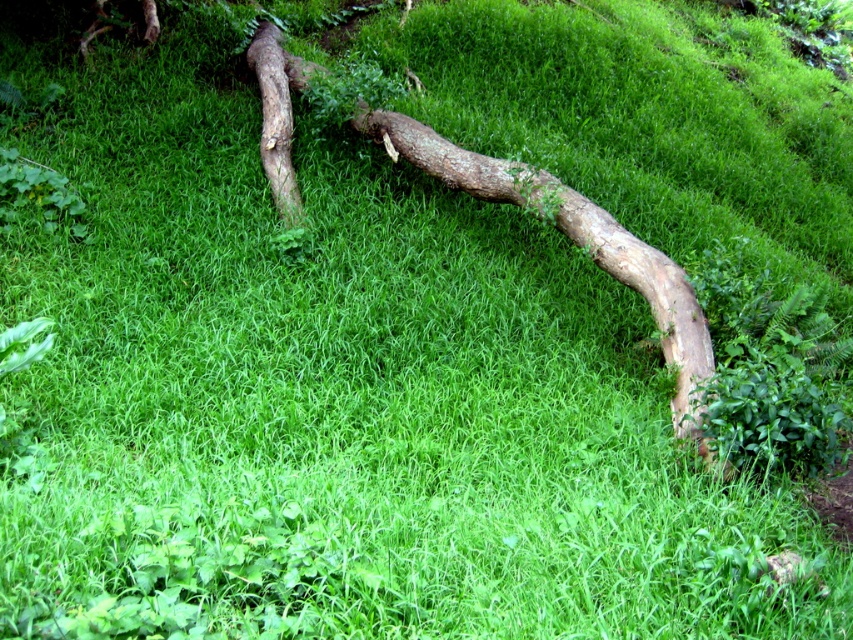
Can you confirm if brown rough wood at center is positioned above brown rough tree trunk at upper left?

Actually, brown rough wood at center is below brown rough tree trunk at upper left.

How far apart are brown rough wood at center and brown rough tree trunk at upper left?

brown rough wood at center is 1.49 meters away from brown rough tree trunk at upper left.

Where is `brown rough wood at center`? brown rough wood at center is located at coordinates (573, 243).